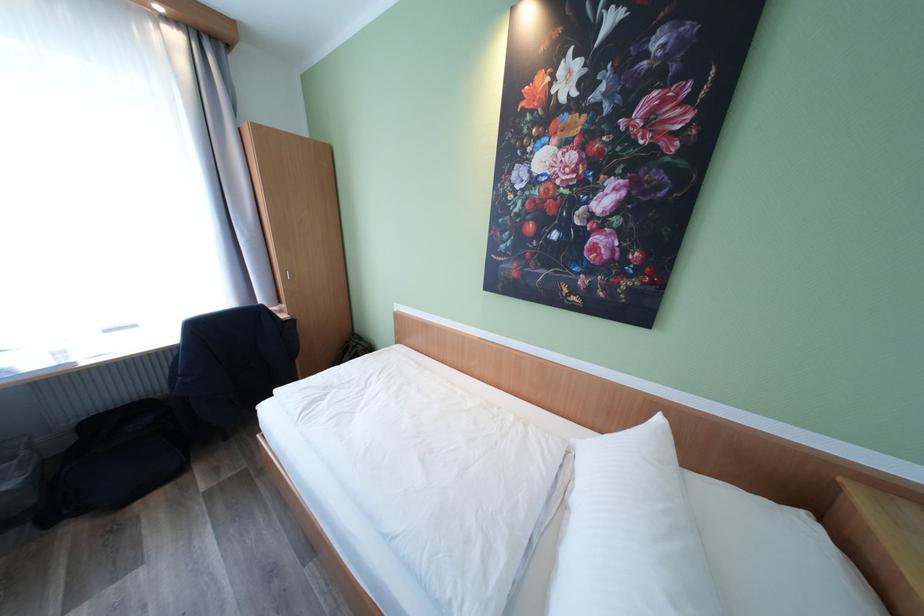
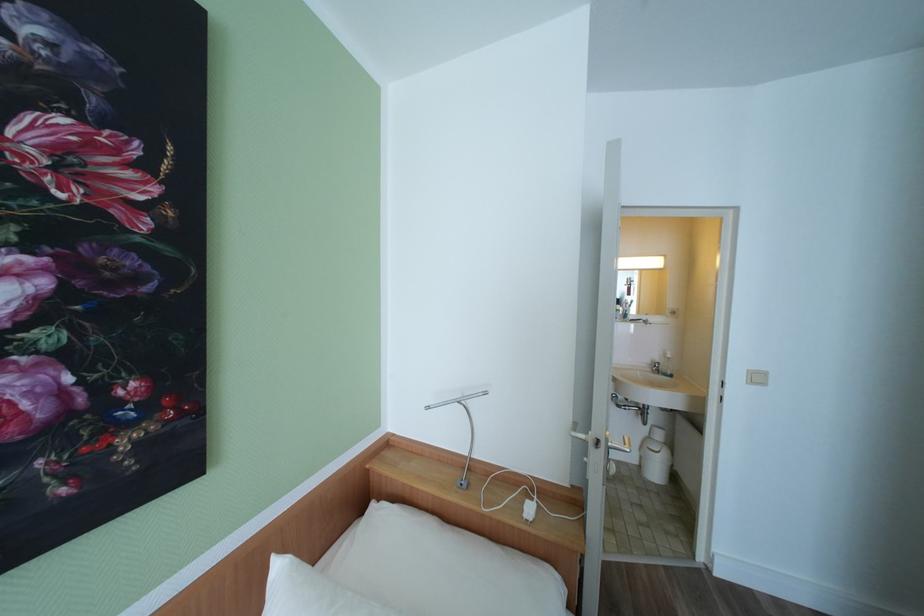
Question: The first image is from the beginning of the video and the second image is from the end. How did the camera likely rotate when shooting the video?

Choices:
 (A) Left
 (B) Right
 (C) Up
 (D) Down

Answer: (B)